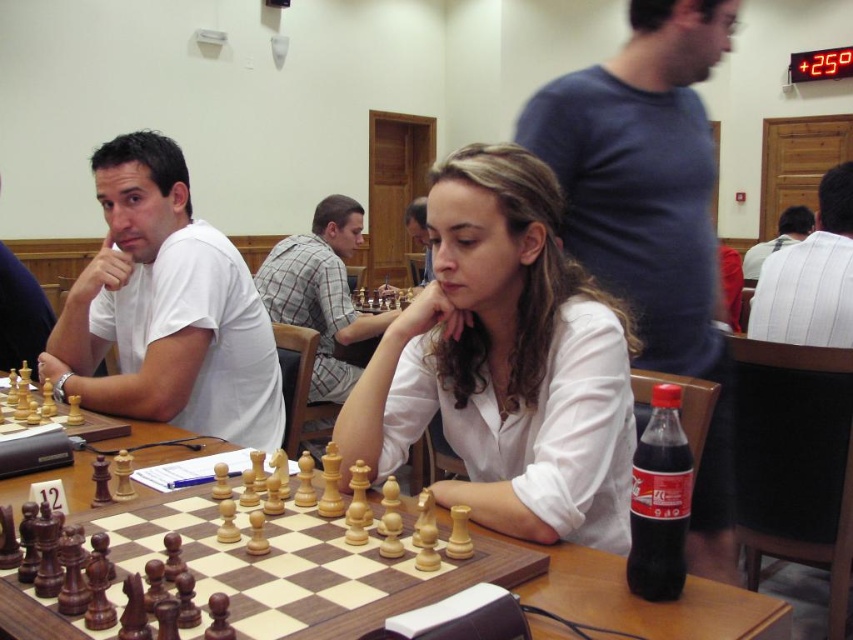
You are a chess player who just entered the tournament hall and see the wooden chessboard at center located at point (650,604). Where should you place your rook during the initial setup?

During the initial setup, the rook should be placed at the corners of the first and eighth ranks on the wooden chessboard at center located at point (650,604).

You are a photographer taking a group photo of the two players at the chessboard. You notice the white matte shirt at center and the plaid fabric shirt at center. Which shirt should you adjust to ensure both are visible in the frame, considering their sizes?

The white matte shirt at center is smaller than the plaid fabric shirt at center. To ensure both are visible, adjust the white matte shirt at center to avoid it being obscured by the larger plaid fabric shirt at center.